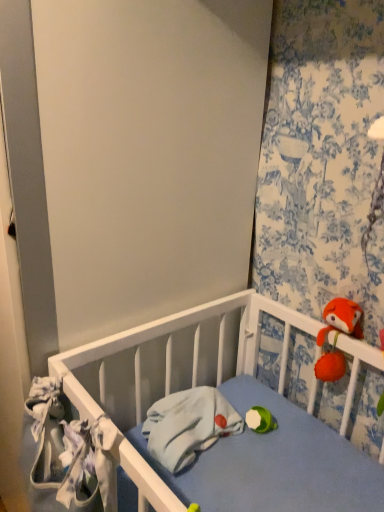
Question: Looking at their shapes, would you say white fabric at left, positioned as the first material in front-to-back order, is wider or thinner than light blue fabric at center, arranged as the first material when viewed from the right?

Choices:
 (A) thin
 (B) wide

Answer: (A)

Question: Considering the positions of point (66, 468) and point (178, 461), is point (66, 468) closer or farther from the camera than point (178, 461)?

Choices:
 (A) closer
 (B) farther

Answer: (A)

Question: Which object is the closest to the light blue fabric at center, which appears as the second material when viewed from the front?

Choices:
 (A) fluffy orange plush at upper right
 (B) white fabric at left, which is counted as the first material, starting from the left
 (C) floral fabric curtain at upper right

Answer: (B)

Question: Based on their relative distances, which object is farther from the white fabric at left, which is counted as the first material, starting from the left?

Choices:
 (A) light blue fabric at center, which ranks as the second material in left-to-right order
 (B) fluffy orange plush at upper right
 (C) floral fabric curtain at upper right

Answer: (C)